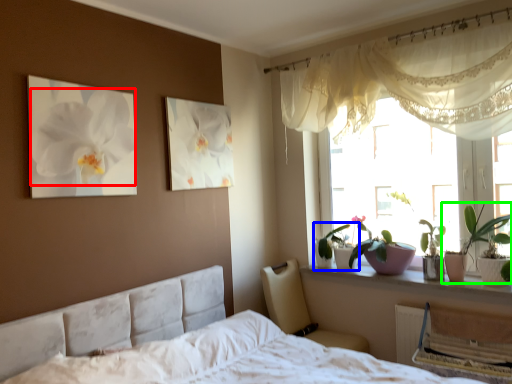
Question: Estimate the real-world distances between objects in this image. Which object is farther from flower (highlighted by a red box), houseplant (highlighted by a blue box) or houseplant (highlighted by a green box)?

Choices:
 (A) houseplant
 (B) houseplant

Answer: (B)